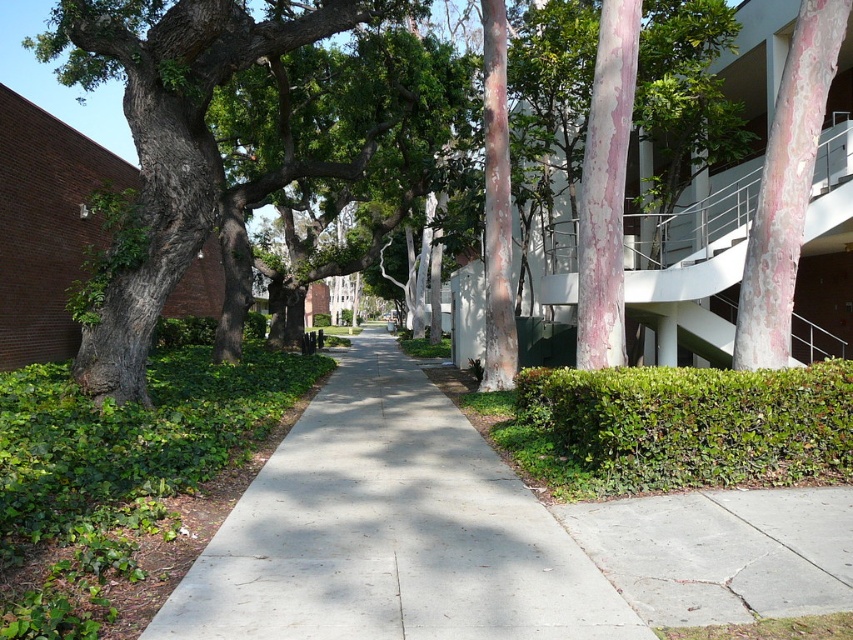
Question: Which of the following is the farthest from the observer?

Choices:
 (A) pink textured bark at upper right
 (B) green leafy hedge at lower center
 (C) gray concrete sidewalk at center

Answer: (A)

Question: Can you confirm if gray concrete sidewalk at lower right is positioned to the left of white paper at center?

Choices:
 (A) no
 (B) yes

Answer: (A)

Question: Which point is closer to the camera taking this photo?

Choices:
 (A) (393, 600)
 (B) (538, 424)

Answer: (A)

Question: Does green leafy hedge at lower center appear on the left side of pink textured bark at upper right?

Choices:
 (A) no
 (B) yes

Answer: (B)

Question: Which of the following is the closest to the observer?

Choices:
 (A) pink textured bark at upper right
 (B) gray concrete sidewalk at lower right

Answer: (B)

Question: Is green leafy tree at center positioned behind gray concrete sidewalk at lower right?

Choices:
 (A) yes
 (B) no

Answer: (A)